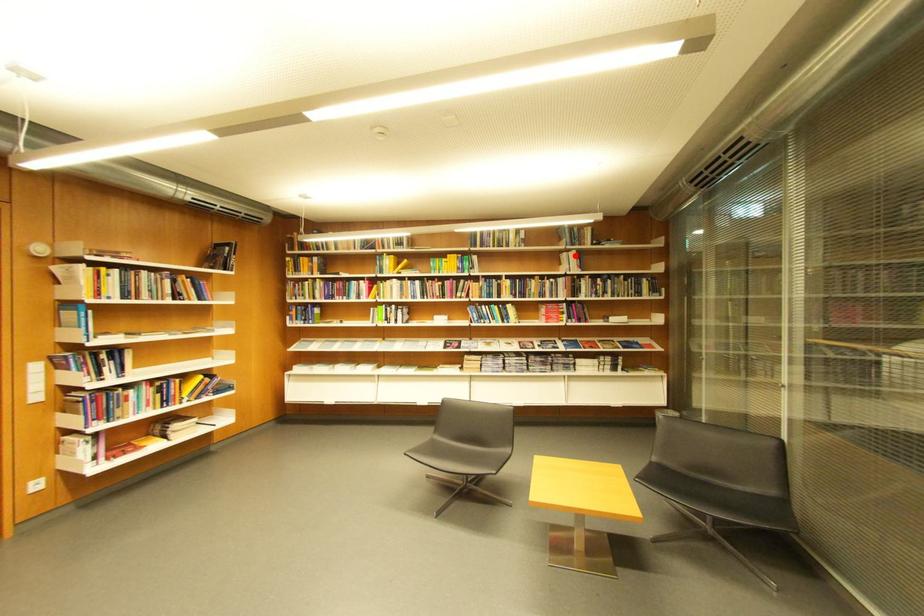
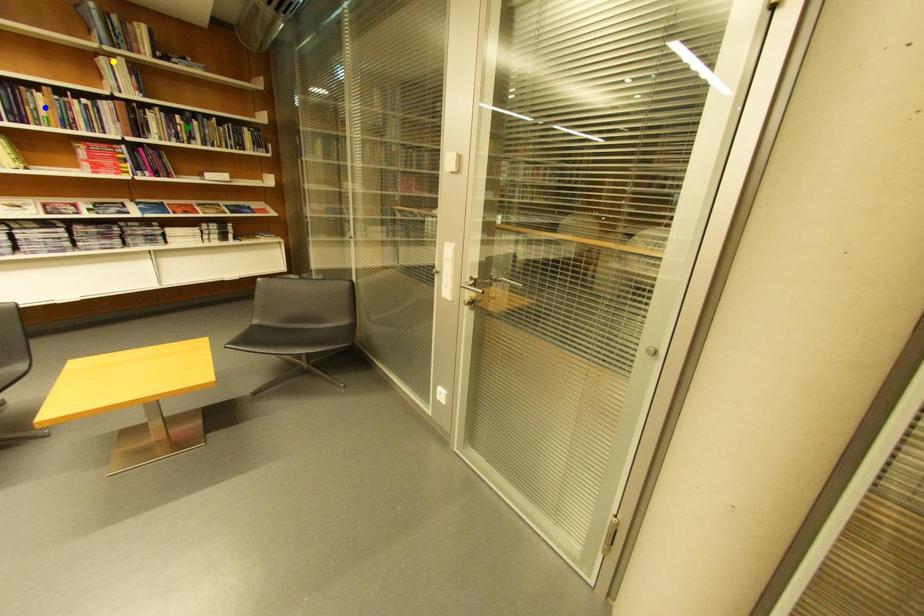
Question: I am providing you with two images of the same scene from different viewpoints. A red point is marked on the first image. You are given multiple points on the second image. Which mark in image 2 goes with the point in image 1?

Choices:
 (A) green point
 (B) blue point
 (C) yellow point

Answer: (C)